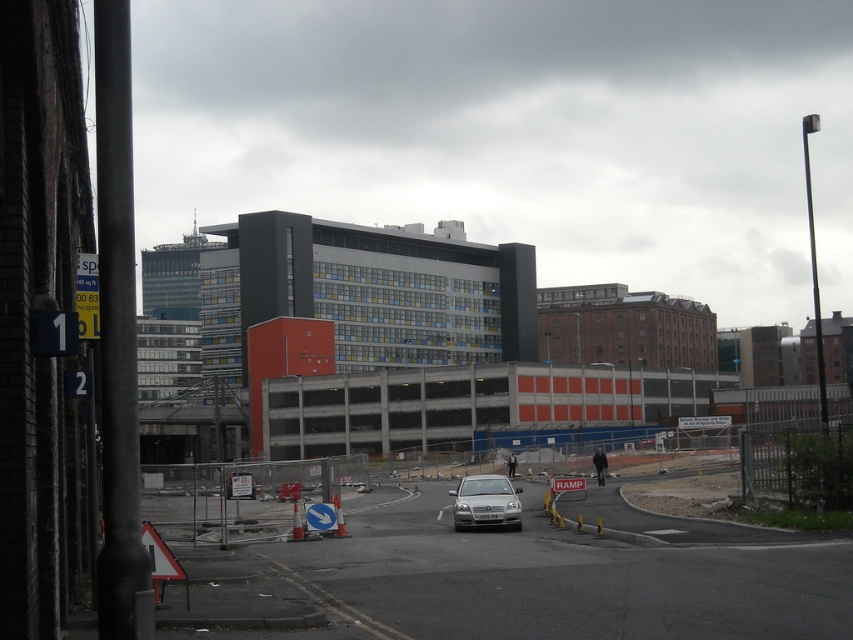
Does point (532, 568) lie behind point (508, 515)?

No, (532, 568) is in front of (508, 515).

Identify the location of concrete fence at lower left. The height and width of the screenshot is (640, 853). (544, 577).